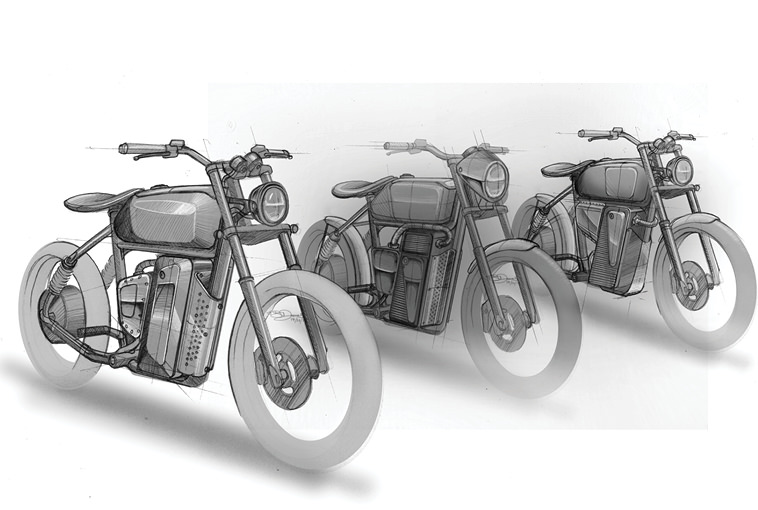
Locate an element on the screen. seat is located at coordinates (86, 206), (355, 188), (562, 166).